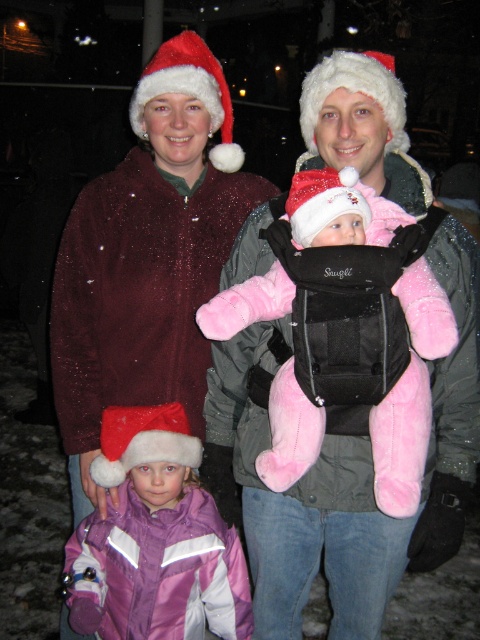
Does sparkly maroon coat at center come in front of pink plush baby carrier at center?

No.

Does sparkly maroon coat at center have a lesser width compared to pink plush baby carrier at center?

No.

Is point (154, 209) positioned behind point (288, 419)?

Yes, it is.

Identify the location of sparkly maroon coat at center. (147, 257).

Measure the distance between pink plush baby carrier at center and camera.

The distance of pink plush baby carrier at center from camera is 4.67 feet.

Is pink plush baby carrier at center bigger than pink plush baby at center?

Correct, pink plush baby carrier at center is larger in size than pink plush baby at center.

Measure the distance between point (372, 461) and camera.

The distance of point (372, 461) from camera is 1.72 meters.

Where is `pink plush baby carrier at center`? This screenshot has width=480, height=640. pink plush baby carrier at center is located at coordinates (326, 340).

Between point (175, 134) and point (118, 579), which one is positioned behind?

Positioned behind is point (175, 134).

Between sparkly maroon coat at center and pink plush baby at center, which one appears on the right side from the viewer's perspective?

sparkly maroon coat at center

I want to click on sparkly maroon coat at center, so click(x=147, y=257).